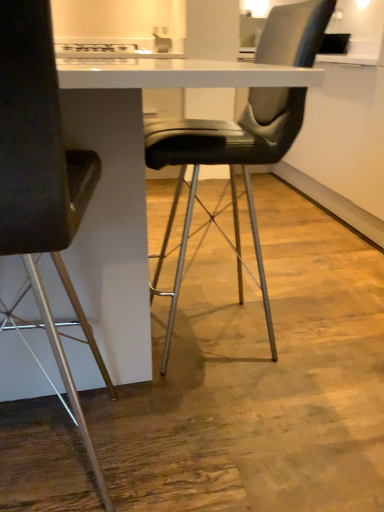
Question: From a real-world perspective, is black leather chair at center, placed as the second chair when sorted from left to right, physically located above or below matte black chair at left, the 1th chair when ordered from left to right?

Choices:
 (A) below
 (B) above

Answer: (B)

Question: Considering the positions of black leather chair at center, the first chair positioned from the right, and matte black chair at left, which is the second chair in right-to-left order, in the image, is black leather chair at center, the first chair positioned from the right, bigger or smaller than matte black chair at left, which is the second chair in right-to-left order,?

Choices:
 (A) big
 (B) small

Answer: (A)

Question: From their relative heights in the image, would you say black leather chair at center, placed as the second chair when sorted from left to right, is taller or shorter than matte black chair at left, the 1th chair when ordered from left to right?

Choices:
 (A) short
 (B) tall

Answer: (B)

Question: Is matte black chair at left, the 1th chair when ordered from left to right, wider or thinner than black leather chair at center, the first chair positioned from the right?

Choices:
 (A) thin
 (B) wide

Answer: (A)

Question: From a real-world perspective, is matte black chair at left, which is the second chair in right-to-left order, physically located above or below black leather chair at center, placed as the second chair when sorted from left to right?

Choices:
 (A) below
 (B) above

Answer: (A)

Question: In the image, is matte black chair at left, which is the second chair in right-to-left order, positioned in front of or behind black leather chair at center, placed as the second chair when sorted from left to right?

Choices:
 (A) front
 (B) behind

Answer: (A)

Question: Is matte black chair at left, which is the second chair in right-to-left order, taller or shorter than black leather chair at center, placed as the second chair when sorted from left to right?

Choices:
 (A) tall
 (B) short

Answer: (B)